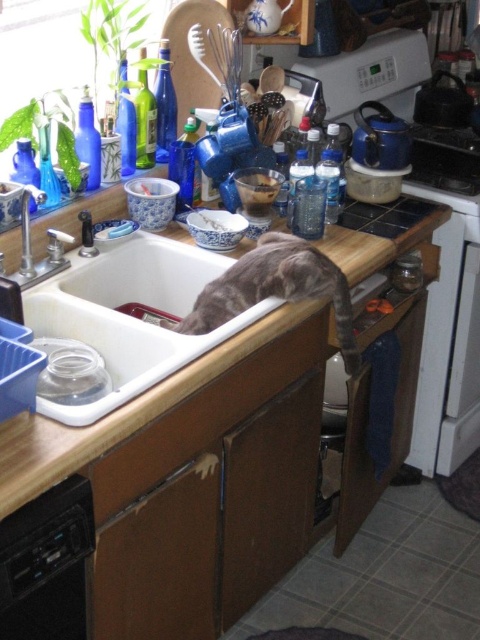
Looking at this image, you are a person trying to clean the kitchen sink. You have a sponge that can only reach areas within 10 cm of the sink edge. Considering the size difference between the white ceramic sink at center and the brushed metal faucet at sink left, which object might the sponge struggle to clean thoroughly?

The sponge might struggle to clean the brushed metal faucet at sink left thoroughly because the white ceramic sink at center is larger, so the faucet is smaller and harder to reach with the sponge within the 10 cm limit.

You are standing in the kitchen and want to place a small plant between the two points labeled point (389,250) and point (24,218). Which point should the plant be closer to so it is nearer to the viewer?

The plant should be placed closer to point (389,250) because it is further to the viewer than point (24,218).